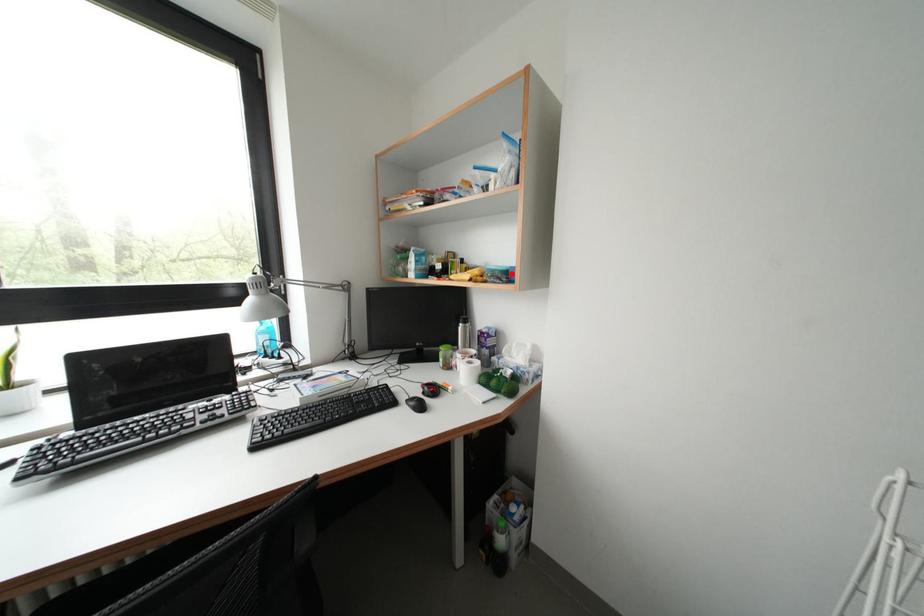
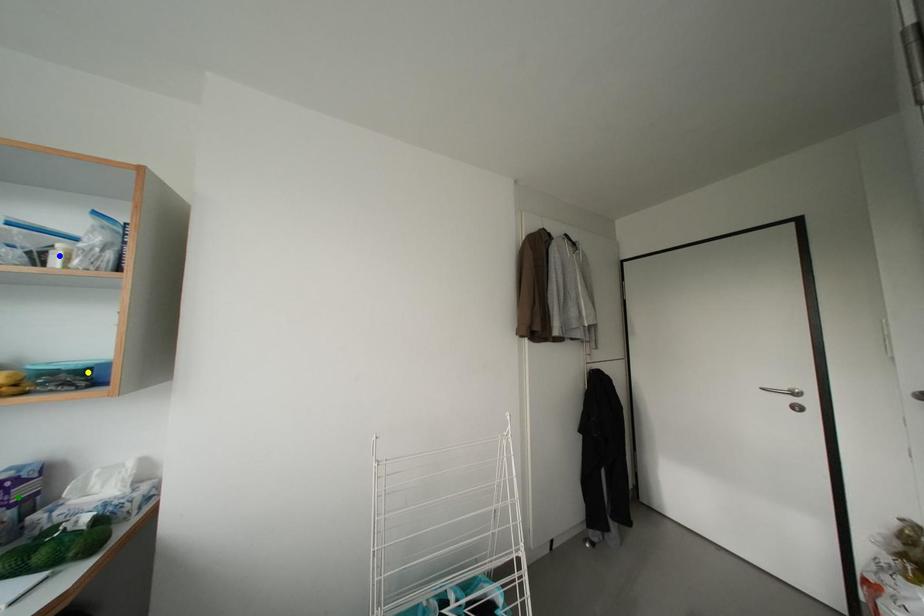
Question: I am providing you with two images of the same scene from different viewpoints. A red point is marked on the first image. You are given multiple points on the second image. Which point in image 2 is actually the same real-world point as the red point in image 1?

Choices:
 (A) green point
 (B) blue point
 (C) yellow point

Answer: (C)